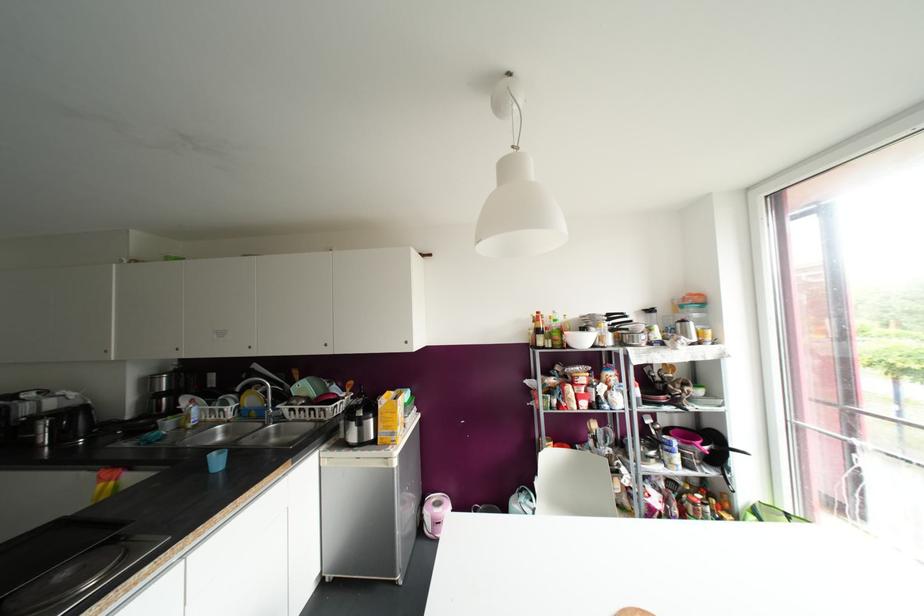
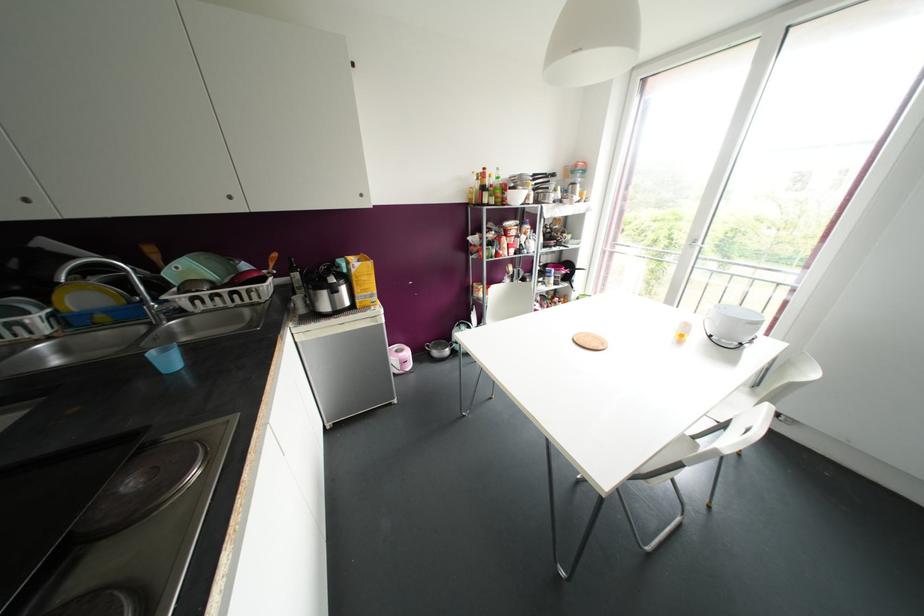
The point at (387,415) is marked in the first image. Where is the corresponding point in the second image?

(363, 277)